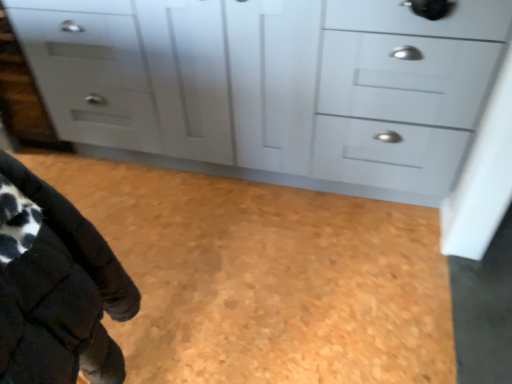
I want to click on matte white cabinet at center, so click(272, 86).

Describe the element at coordinates (272, 86) in the screenshot. I see `matte white cabinet at center` at that location.

The image size is (512, 384). I want to click on matte white cabinet at center, so click(x=272, y=86).